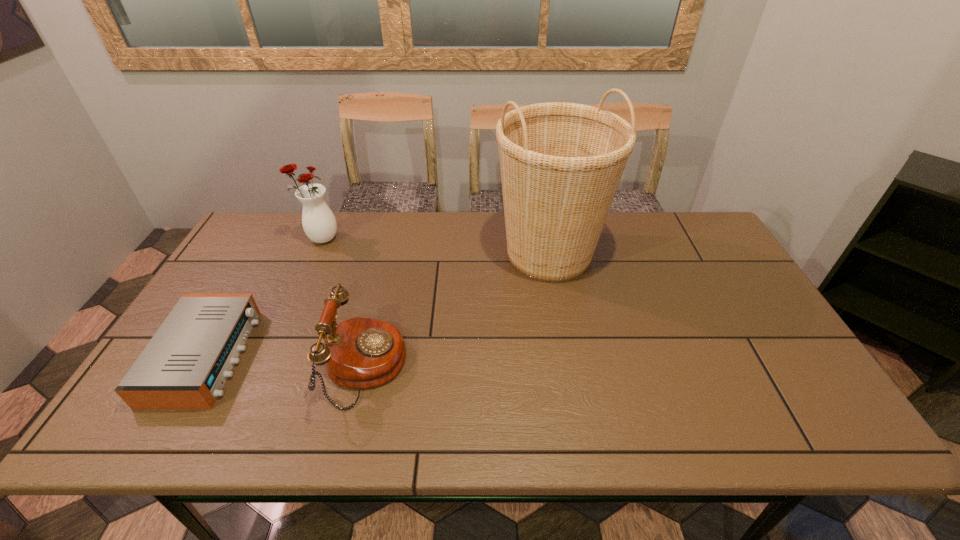
Locate an element on the screen. This screenshot has height=540, width=960. free location that satisfies the following two spatial constraints: 1. on the front side of the third shortest object; 2. on the control panel of the shortest object is located at coordinates (269, 356).